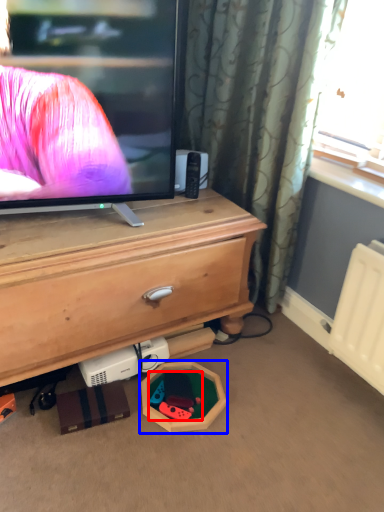
Question: Which of the following is the farthest to the observer, toy (highlighted by a red box) or toy (highlighted by a blue box)?

Choices:
 (A) toy
 (B) toy

Answer: (A)